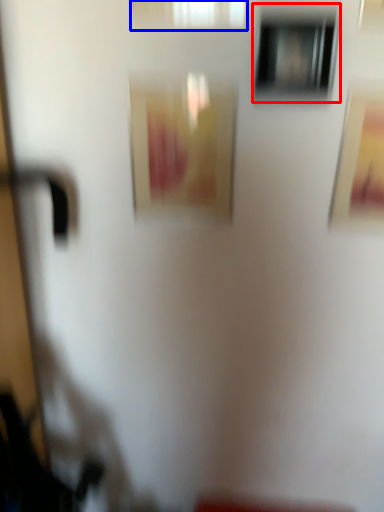
Question: Which object is further to the camera taking this photo, window (highlighted by a red box) or window (highlighted by a blue box)?

Choices:
 (A) window
 (B) window

Answer: (A)